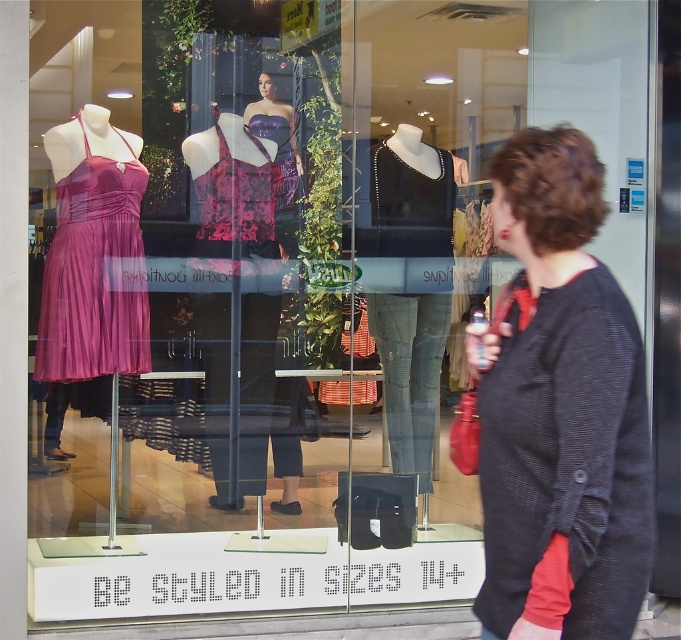
Which of these two, black textured sweater at center or matte purple dress at center, stands shorter?

Standing shorter between the two is black textured sweater at center.

Which is above, black textured sweater at center or matte purple dress at center?

matte purple dress at center

Which is behind, point (516, 416) or point (219, 365)?

The point (219, 365) is behind.

Where is `black textured sweater at center`? The image size is (681, 640). black textured sweater at center is located at coordinates (558, 410).

Describe the element at coordinates (244, 177) in the screenshot. I see `matte purple dress at center` at that location.

Between matte purple dress at center and purple pleated dress at left, which one appears on the left side from the viewer's perspective?

From the viewer's perspective, purple pleated dress at left appears more on the left side.

Between point (217, 164) and point (84, 248), which one is positioned behind?

Positioned behind is point (217, 164).

Where is `matte purple dress at center`? This screenshot has height=640, width=681. matte purple dress at center is located at coordinates (244, 177).

Does black textured sweater at center appear over purple pleated dress at left?

Incorrect, black textured sweater at center is not positioned above purple pleated dress at left.

Locate an element on the screen. The image size is (681, 640). black textured sweater at center is located at coordinates (558, 410).

Find the location of a particular element. The image size is (681, 640). black textured sweater at center is located at coordinates (558, 410).